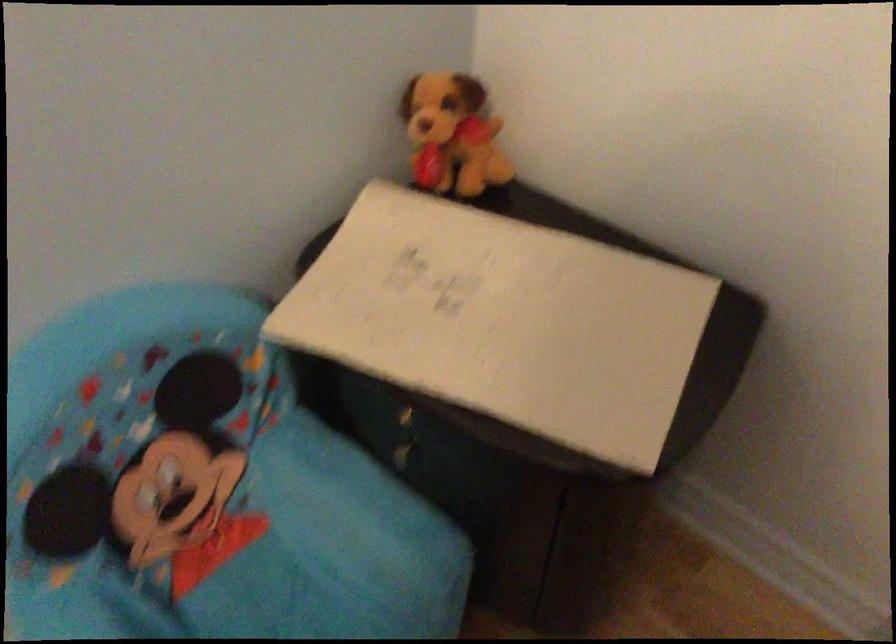
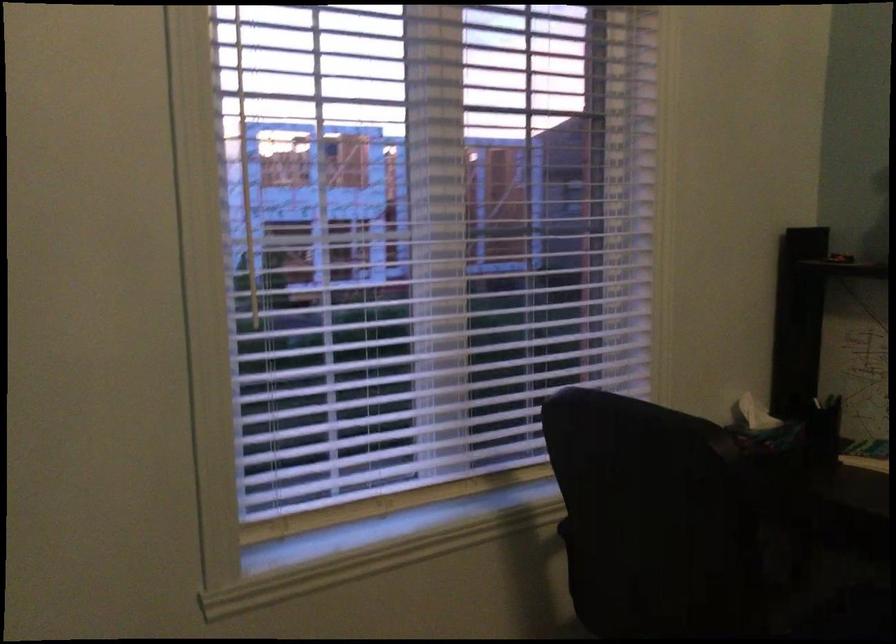
Question: The camera is either moving clockwise (left) or counter-clockwise (right) around the object. The first image is from the beginning of the video and the second image is from the end. Is the camera moving left or right when shooting the video?

Choices:
 (A) Left
 (B) Right

Answer: (A)